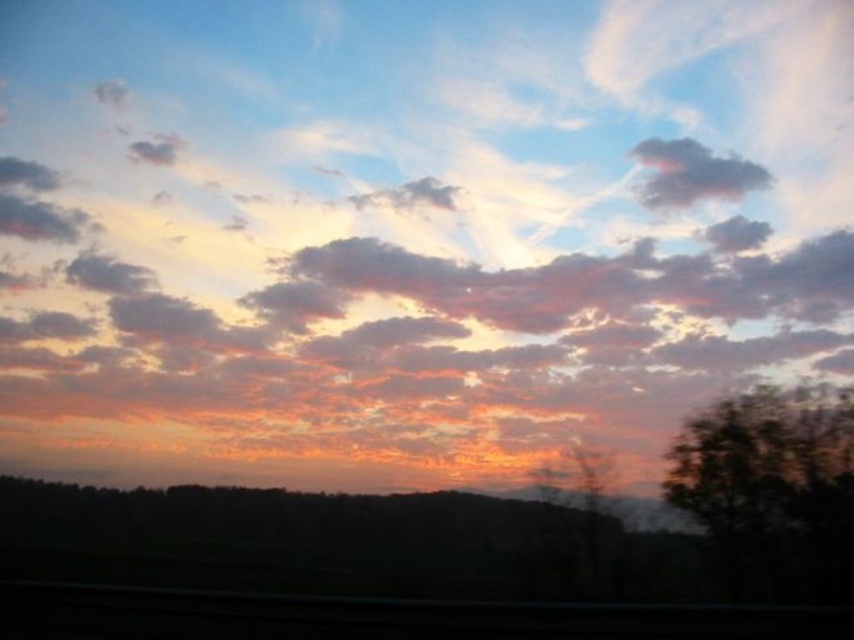
Question: Which point is farther to the camera?

Choices:
 (A) dark gray fluffy cloud at upper center
 (B) dark green leafy tree at right

Answer: (A)

Question: In this image, where is dark green leafy tree at right located relative to dark gray fluffy cloud at upper center?

Choices:
 (A) right
 (B) left

Answer: (B)

Question: Which of the following is the closest to the observer?

Choices:
 (A) dark green leafy tree at right
 (B) dark gray fluffy cloud at upper center

Answer: (A)

Question: Which point is closer to the camera?

Choices:
 (A) dark gray fluffy cloud at upper center
 (B) dark green leafy tree at right

Answer: (B)

Question: Does dark green leafy tree at right appear on the right side of dark gray fluffy cloud at upper center?

Choices:
 (A) no
 (B) yes

Answer: (A)

Question: Is dark green leafy tree at right wider than dark gray fluffy cloud at upper center?

Choices:
 (A) yes
 (B) no

Answer: (B)